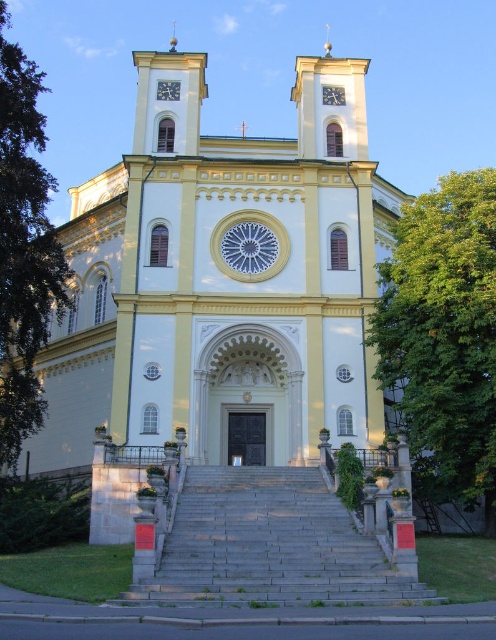
Question: Is yellow stone church at center further to camera compared to green leafy tree at right?

Choices:
 (A) no
 (B) yes

Answer: (B)

Question: Does yellow stone church at center have a lesser width compared to green leafy tree at right?

Choices:
 (A) no
 (B) yes

Answer: (A)

Question: Which of the following is the closest to the observer?

Choices:
 (A) green leafy tree at left
 (B) metallic clock face at center

Answer: (A)

Question: Can you confirm if green leafy tree at right is positioned below metallic clock at upper center?

Choices:
 (A) yes
 (B) no

Answer: (A)

Question: Which object is the farthest from the green leafy tree at left?

Choices:
 (A) metallic clock at upper center
 (B) green leafy tree at right

Answer: (B)

Question: Which of these objects is positioned closest to the metallic clock face at center?

Choices:
 (A) green leafy tree at right
 (B) yellow stone church at center

Answer: (B)